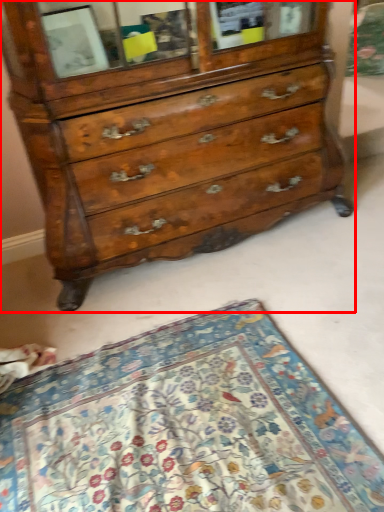
Question: From the image, what is the correct spatial relationship of chest of drawers (annotated by the red box) in relation to mat?

Choices:
 (A) left
 (B) right

Answer: (B)